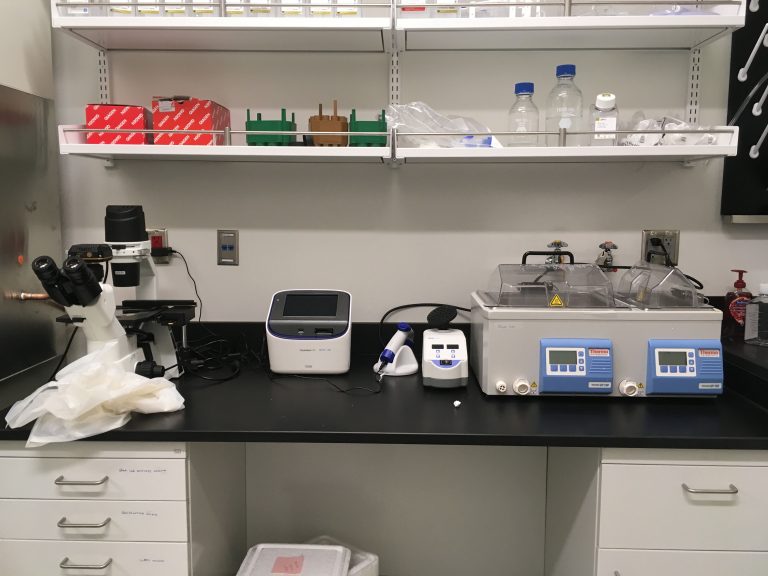
Find the location of `middle drawer on the left`. middle drawer on the left is located at coordinates coord(156,520).